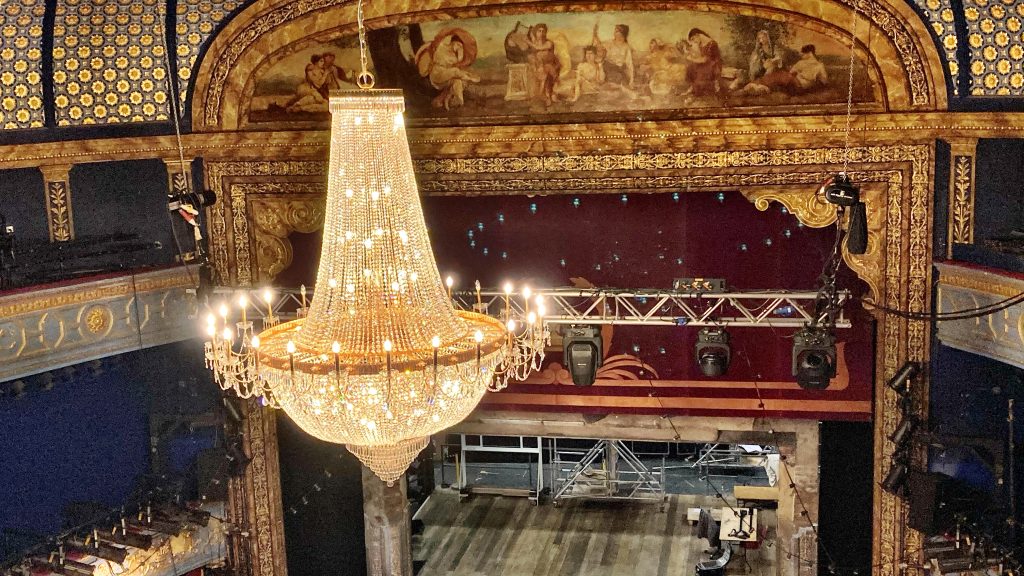
At what (x,y) coordinates should I click in order to perform the action: click on lights. Please return your answer as a coordinate pair (x, y). The image size is (1024, 576). Looking at the image, I should click on (819, 357), (725, 356), (586, 363), (901, 401), (888, 472).